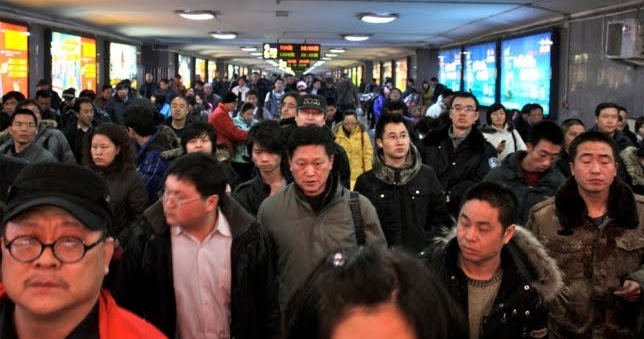
Find the location of a particular element. light up sign is located at coordinates (73, 64).